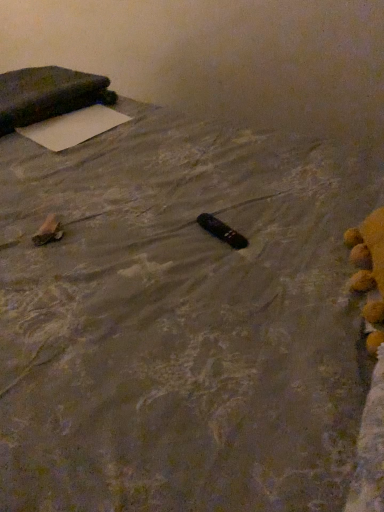
Question: Looking at their shapes, would you say white matte yoga mat at upper left is wider or thinner than dark fabric pillow at upper left?

Choices:
 (A) thin
 (B) wide

Answer: (A)

Question: Is white matte yoga mat at upper left inside or outside of dark fabric pillow at upper left?

Choices:
 (A) inside
 (B) outside

Answer: (B)

Question: Which is nearer to the black plastic remote at center, marked as the 1th waste in a right-to-left arrangement?

Choices:
 (A) brown paper bag at lower left, the 1th waste in the left-to-right sequence
 (B) white matte yoga mat at upper left
 (C) dark fabric pillow at upper left

Answer: (A)

Question: Estimate the real-world distances between objects in this image. Which object is farther from the white matte yoga mat at upper left?

Choices:
 (A) brown paper bag at lower left, the second waste when ordered from right to left
 (B) dark fabric pillow at upper left
 (C) black plastic remote at center, which appears as the 2th waste when viewed from the left

Answer: (C)